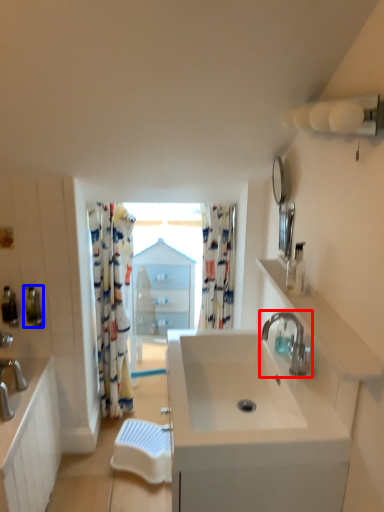
Question: Which object appears closest to the camera in this image, tap (highlighted by a red box) or soap dispenser (highlighted by a blue box)?

Choices:
 (A) tap
 (B) soap dispenser

Answer: (A)